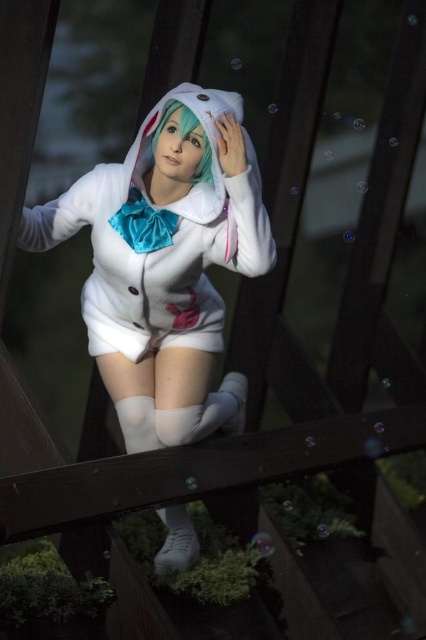
Is white plush bunny costume at center taller than green matte hair at center?

Yes.

This screenshot has height=640, width=426. In order to click on white plush bunny costume at center in this screenshot , I will do tap(164, 266).

Is point (98, 337) closer to camera compared to point (198, 166)?

That is False.

You are a GUI agent. You are given a task and a screenshot of the screen. Output one action in this format:
    pyautogui.click(x=<x>, y=<y>)
    Task: Click on the white plush bunny costume at center
    
    Given the screenshot: What is the action you would take?
    tap(164, 266)

From the picture: Between white plush bunny costume at center and white fabric at center, which one is positioned lower?

white plush bunny costume at center is lower down.

Which is behind, point (167, 508) or point (215, 326)?

Positioned behind is point (167, 508).

What do you see at coordinates (164, 266) in the screenshot? I see `white plush bunny costume at center` at bounding box center [164, 266].

I want to click on white plush bunny costume at center, so click(164, 266).

Does white fabric at center have a smaller size compared to green matte hair at center?

Actually, white fabric at center might be larger than green matte hair at center.

Is point (92, 340) closer to camera compared to point (184, 129)?

No, (92, 340) is further to viewer.

Locate an element on the screen. white fabric at center is located at coordinates (141, 333).